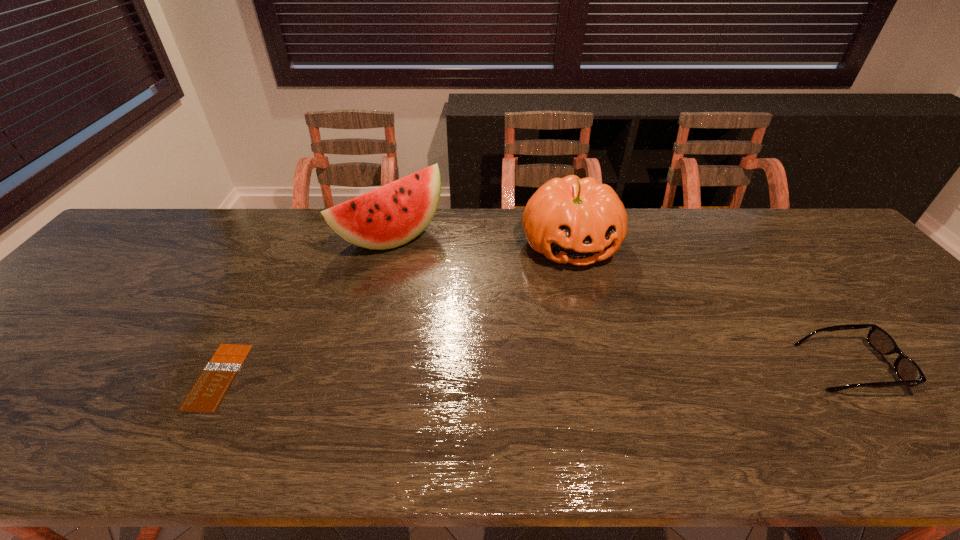
The height and width of the screenshot is (540, 960). I want to click on free point between the spectacles and the chocolate bar, so click(x=533, y=372).

Where is `unoccupied area between the second shortest object and the pumpkin`? unoccupied area between the second shortest object and the pumpkin is located at coordinates (709, 306).

I want to click on empty space that is in between the spectacles and the shortest object, so click(533, 372).

Where is `object that stands as the second closest to the watermelon`? object that stands as the second closest to the watermelon is located at coordinates (206, 395).

Where is `object that is the closest to the pumpkin`? The height and width of the screenshot is (540, 960). object that is the closest to the pumpkin is located at coordinates (392, 215).

Where is `vacant area that satisfies the following two spatial constraints: 1. on the front side of the watermelon; 2. on the lenses of the rightmost object`? vacant area that satisfies the following two spatial constraints: 1. on the front side of the watermelon; 2. on the lenses of the rightmost object is located at coordinates (360, 367).

This screenshot has width=960, height=540. Find the location of `vacant region that satisfies the following two spatial constraints: 1. on the front side of the third object from left to right; 2. on the right side of the second object from left to right`. vacant region that satisfies the following two spatial constraints: 1. on the front side of the third object from left to right; 2. on the right side of the second object from left to right is located at coordinates pyautogui.click(x=390, y=244).

Find the location of a particular element. free space that satisfies the following two spatial constraints: 1. on the front side of the rightmost object; 2. on the lenses of the second object from right to left is located at coordinates (601, 367).

This screenshot has width=960, height=540. I want to click on vacant area in the image that satisfies the following two spatial constraints: 1. on the front side of the watermelon; 2. on the lenses of the second shortest object, so tap(360, 367).

Where is `blank area in the image that satisfies the following two spatial constraints: 1. on the front side of the spectacles; 2. on the lenses of the second object from left to right`? The height and width of the screenshot is (540, 960). blank area in the image that satisfies the following two spatial constraints: 1. on the front side of the spectacles; 2. on the lenses of the second object from left to right is located at coordinates (360, 367).